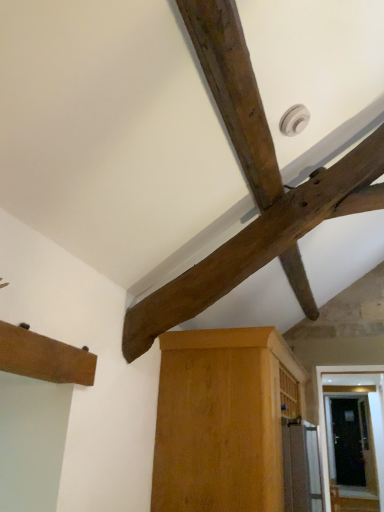
Question: Would you say brown wood cabinet at lower left, the second cabinetry positioned from the back, is outside light brown wood cabinet at center, positioned as the 2th cabinetry in top-to-bottom order?

Choices:
 (A) no
 (B) yes

Answer: (B)

Question: Is brown wood cabinet at lower left, the first cabinetry from the top, turned away from light brown wood cabinet at center, positioned as the 2th cabinetry in top-to-bottom order?

Choices:
 (A) yes
 (B) no

Answer: (B)

Question: Does brown wood cabinet at lower left, the first cabinetry in the front-to-back sequence, touch light brown wood cabinet at center, marked as the 1th cabinetry in a back-to-front arrangement?

Choices:
 (A) no
 (B) yes

Answer: (A)

Question: From the image's perspective, is brown wood cabinet at lower left, the 2th cabinetry ordered from the bottom, over light brown wood cabinet at center, marked as the 1th cabinetry in a back-to-front arrangement?

Choices:
 (A) yes
 (B) no

Answer: (A)

Question: Is brown wood cabinet at lower left, the 2th cabinetry from the right, at the left side of light brown wood cabinet at center, which appears as the first cabinetry when viewed from the right?

Choices:
 (A) no
 (B) yes

Answer: (B)

Question: Is brown wood cabinet at lower left, the 2th cabinetry ordered from the bottom, taller than light brown wood cabinet at center, marked as the 1th cabinetry in a back-to-front arrangement?

Choices:
 (A) yes
 (B) no

Answer: (B)

Question: From a real-world perspective, is brown wood cabinet at lower left, the 2th cabinetry ordered from the bottom, positioned over dark brown wood beam at upper center based on gravity?

Choices:
 (A) no
 (B) yes

Answer: (A)

Question: Is dark brown wood beam at upper center at the back of brown wood cabinet at lower left, the 2th cabinetry ordered from the bottom?

Choices:
 (A) yes
 (B) no

Answer: (B)

Question: Is dark brown wood beam at upper center completely or partially inside brown wood cabinet at lower left, the 2th cabinetry ordered from the bottom?

Choices:
 (A) no
 (B) yes

Answer: (A)

Question: Is brown wood cabinet at lower left, the second cabinetry positioned from the back, aimed at dark brown wood beam at upper center?

Choices:
 (A) yes
 (B) no

Answer: (B)

Question: Considering the relative positions of brown wood cabinet at lower left, the 2th cabinetry from the right, and dark brown wood beam at upper center in the image provided, is brown wood cabinet at lower left, the 2th cabinetry from the right, to the left of dark brown wood beam at upper center from the viewer's perspective?

Choices:
 (A) yes
 (B) no

Answer: (A)

Question: Considering the relative positions of brown wood cabinet at lower left, the first cabinetry viewed from the left, and dark brown wood beam at upper center in the image provided, is brown wood cabinet at lower left, the first cabinetry viewed from the left, to the right of dark brown wood beam at upper center from the viewer's perspective?

Choices:
 (A) yes
 (B) no

Answer: (B)

Question: From a real-world perspective, is light brown wood cabinet at center, marked as the 1th cabinetry in a back-to-front arrangement, positioned over brown wood cabinet at lower left, the first cabinetry viewed from the left, based on gravity?

Choices:
 (A) yes
 (B) no

Answer: (B)